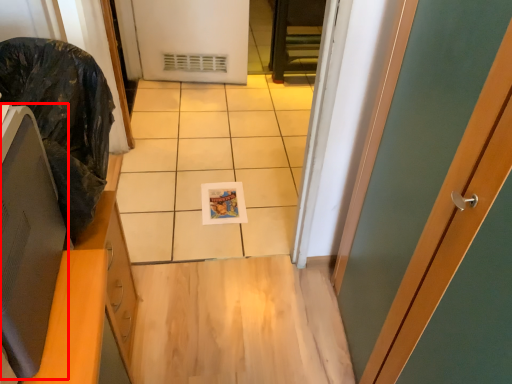
Question: From the image's perspective, what is the correct spatial positioning of computer monitor (annotated by the red box) in reference to garbage?

Choices:
 (A) below
 (B) above

Answer: (A)